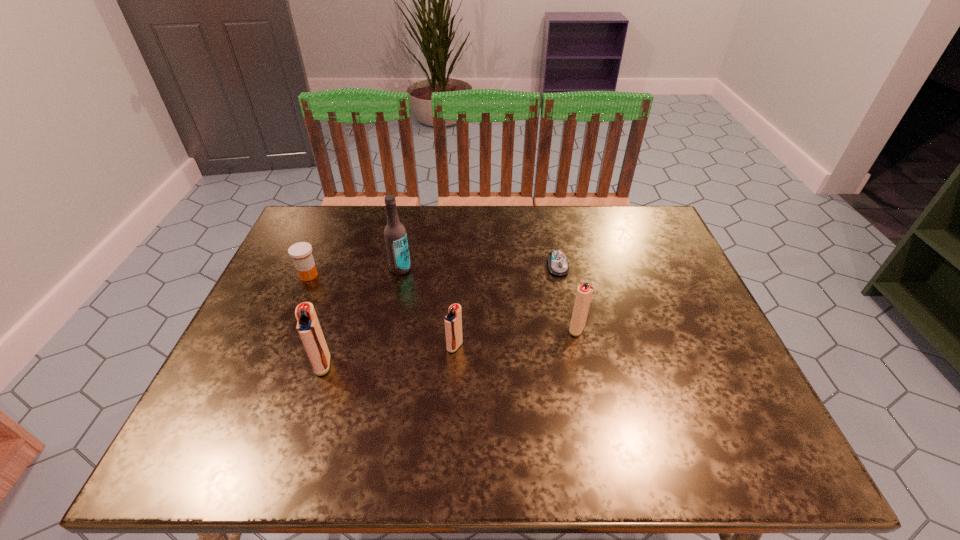
At what (x,y) coordinates should I click in order to perform the action: click on free spot that satisfies the following two spatial constraints: 1. on the back side of the leftmost igniter; 2. on the left side of the fourth shortest object. Please return your answer as a coordinate pair (x, y). Looking at the image, I should click on (334, 329).

Locate an element on the screen. This screenshot has height=540, width=960. free space that satisfies the following two spatial constraints: 1. on the label of the second shortest igniter; 2. on the right side of the tallest object is located at coordinates (388, 329).